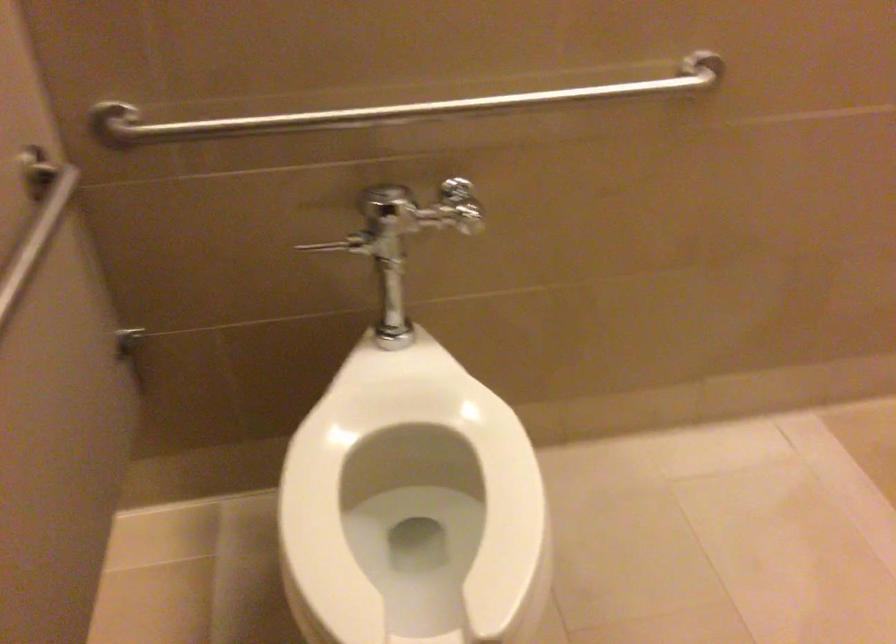
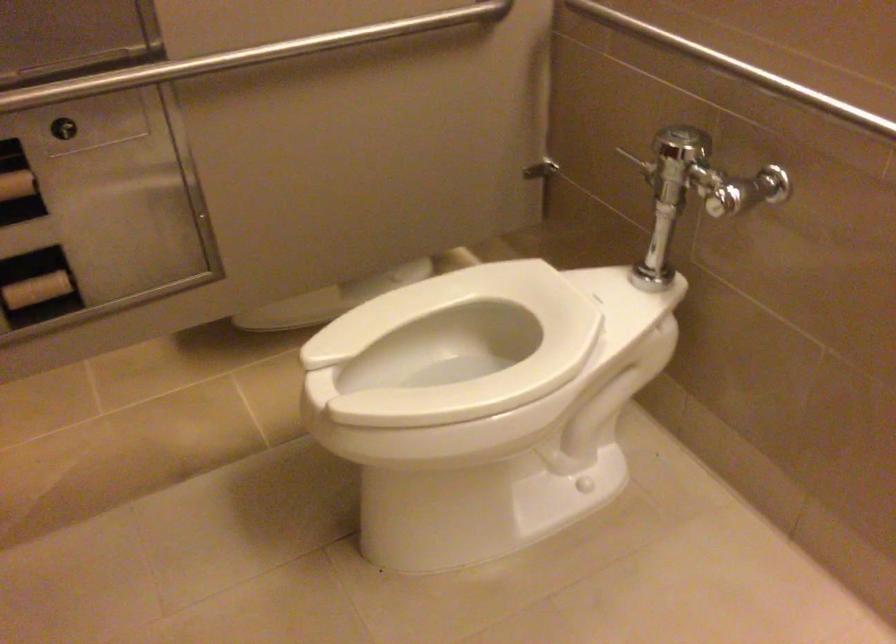
Based on the continuous images, in which direction is the camera rotating?

The camera rotated toward left-down.